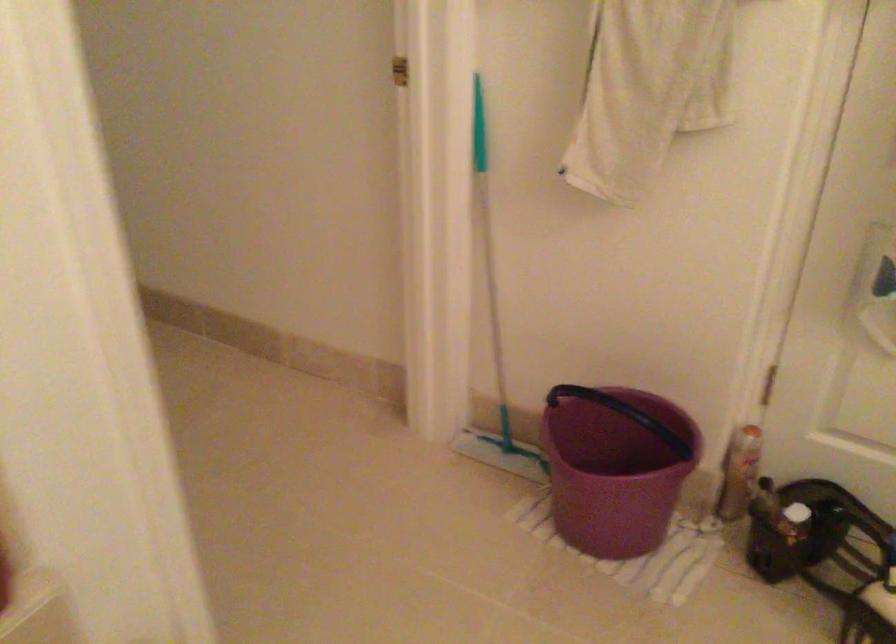
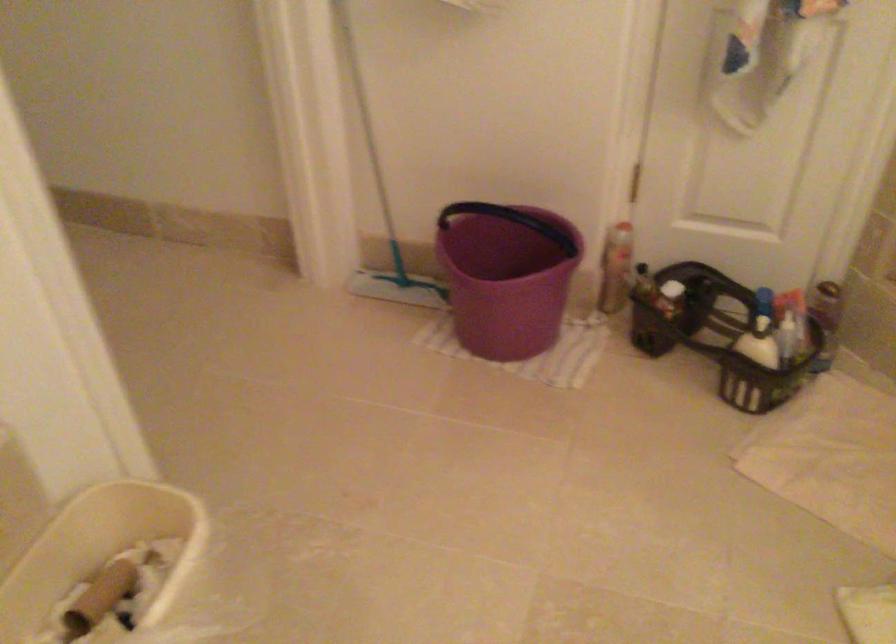
Question: The camera is either moving clockwise (left) or counter-clockwise (right) around the object. The first image is from the beginning of the video and the second image is from the end. Is the camera moving left or right when shooting the video?

Choices:
 (A) Left
 (B) Right

Answer: (A)